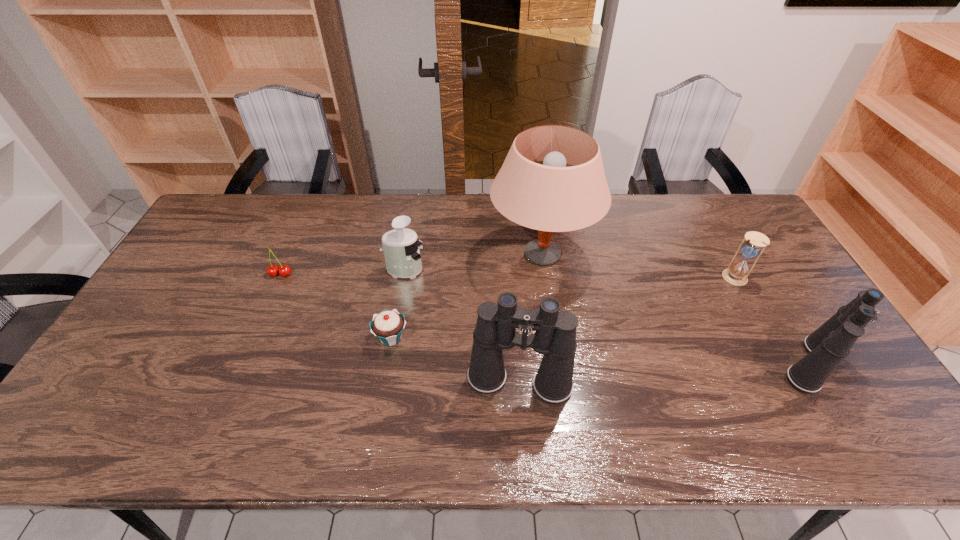
The height and width of the screenshot is (540, 960). What are the coordinates of `vacant space located 0.050m on the left of the right binoculars` in the screenshot? It's located at (758, 364).

In order to click on free space located 0.320m with the stems of the leftmost object pointing upwards in this screenshot , I will do `click(239, 369)`.

What are the coordinates of `vacant region located 0.320m on the left of the cupcake` in the screenshot? It's located at (255, 338).

Find the location of a particular element. vacant position located on the front of the hourglass is located at coordinates (800, 396).

Where is `vacant space located on the front-facing side of the tallest object`? The image size is (960, 540). vacant space located on the front-facing side of the tallest object is located at coordinates (374, 254).

The width and height of the screenshot is (960, 540). I want to click on free space located on the front-facing side of the tallest object, so click(443, 254).

Find the location of `vacant space located on the front-facing side of the tallest object`. vacant space located on the front-facing side of the tallest object is located at coordinates (377, 254).

The image size is (960, 540). What are the coordinates of `free spot located on the front of the juicer` in the screenshot? It's located at (397, 313).

Locate an element on the screen. This screenshot has width=960, height=540. object that is at the far edge is located at coordinates (551, 197).

This screenshot has width=960, height=540. What are the coordinates of `binoculars that is at the right edge` in the screenshot? It's located at (827, 346).